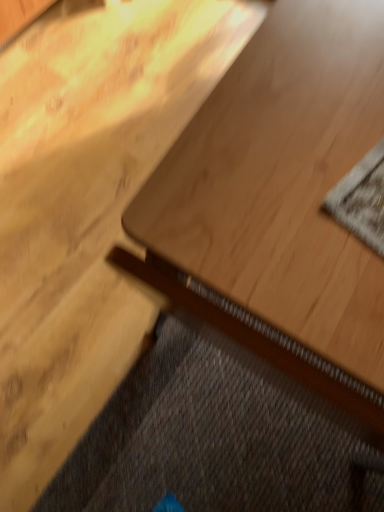
What are the coordinates of `free region on the left part of dark gray textured doormat at lower left` in the screenshot? It's located at (57, 344).